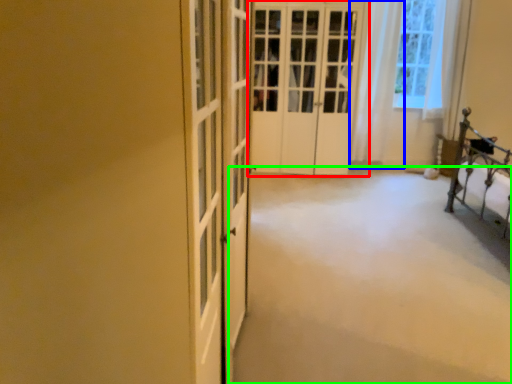
Question: Estimate the real-world distances between objects in this image. Which object is farther from door (highlighted by a red box), curtain (highlighted by a blue box) or plain (highlighted by a green box)?

Choices:
 (A) curtain
 (B) plain

Answer: (B)